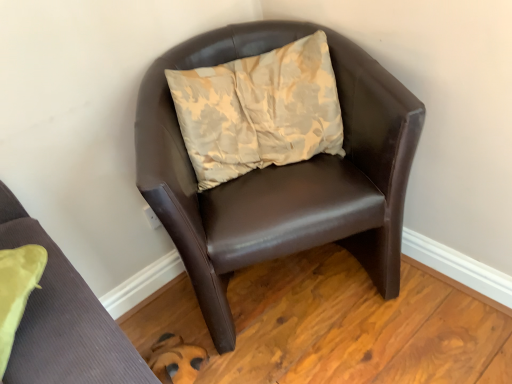
Question: In terms of width, does brown leather chair at center, the first chair in the back-to-front sequence, look wider or thinner when compared to brown leather chair at upper right, acting as the first chair starting from the front?

Choices:
 (A) thin
 (B) wide

Answer: (B)

Question: From a real-world perspective, is brown leather chair at center, acting as the second chair starting from the front, positioned above or below brown leather chair at upper right, which is the 2th chair from back to front?

Choices:
 (A) above
 (B) below

Answer: (B)

Question: Which object is positioned closest to the brown leather chair at center, the first chair in the back-to-front sequence?

Choices:
 (A) brown leather chair at upper right, which is the 2th chair from back to front
 (B) beige floral cushion at center

Answer: (B)

Question: Which of these objects is positioned farthest from the brown leather chair at upper right, acting as the first chair starting from the front?

Choices:
 (A) brown leather chair at center, acting as the second chair starting from the front
 (B) beige floral cushion at center

Answer: (B)